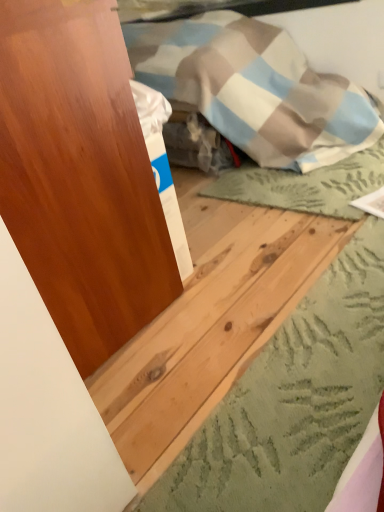
Question: Considering the relative sizes of natural wood plank at center and matte wood dresser at left in the image provided, is natural wood plank at center wider than matte wood dresser at left?

Choices:
 (A) no
 (B) yes

Answer: (B)

Question: Does natural wood plank at center contain matte wood dresser at left?

Choices:
 (A) no
 (B) yes

Answer: (A)

Question: Is natural wood plank at center bigger than matte wood dresser at left?

Choices:
 (A) yes
 (B) no

Answer: (B)

Question: From the image's perspective, is natural wood plank at center located above matte wood dresser at left?

Choices:
 (A) yes
 (B) no

Answer: (B)

Question: From a real-world perspective, is natural wood plank at center physically below matte wood dresser at left?

Choices:
 (A) no
 (B) yes

Answer: (B)

Question: Could you tell me if natural wood plank at center is turned towards matte wood dresser at left?

Choices:
 (A) yes
 (B) no

Answer: (B)

Question: Does matte wood dresser at left have a greater width compared to natural wood plank at center?

Choices:
 (A) yes
 (B) no

Answer: (B)

Question: Can you confirm if matte wood dresser at left is taller than natural wood plank at center?

Choices:
 (A) yes
 (B) no

Answer: (A)

Question: Does matte wood dresser at left have a smaller size compared to natural wood plank at center?

Choices:
 (A) no
 (B) yes

Answer: (A)

Question: Is matte wood dresser at left shorter than natural wood plank at center?

Choices:
 (A) no
 (B) yes

Answer: (A)

Question: Is the position of matte wood dresser at left more distant than that of natural wood plank at center?

Choices:
 (A) no
 (B) yes

Answer: (B)

Question: Is matte wood dresser at left oriented away from natural wood plank at center?

Choices:
 (A) no
 (B) yes

Answer: (A)

Question: Is point (148, 436) positioned closer to the camera than point (152, 271)?

Choices:
 (A) closer
 (B) farther

Answer: (A)